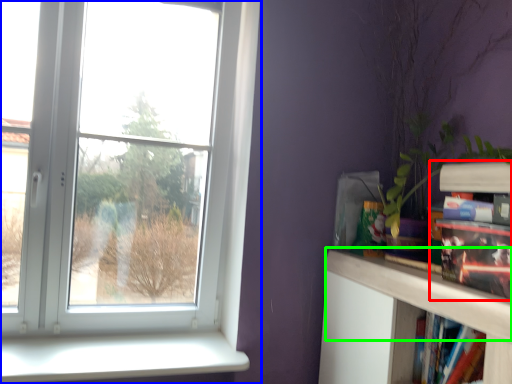
Question: Estimate the real-world distances between objects in this image. Which object is farther from book (highlighted by a red box), window (highlighted by a blue box) or mantle (highlighted by a green box)?

Choices:
 (A) window
 (B) mantle

Answer: (A)